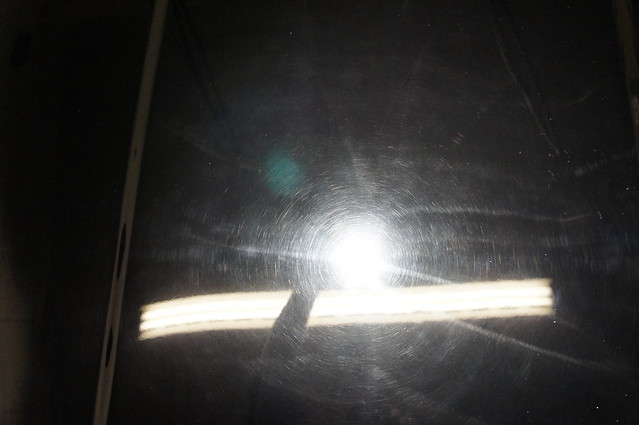
Find the location of `horizontal lights`. horizontal lights is located at coordinates (526, 301), (243, 302).